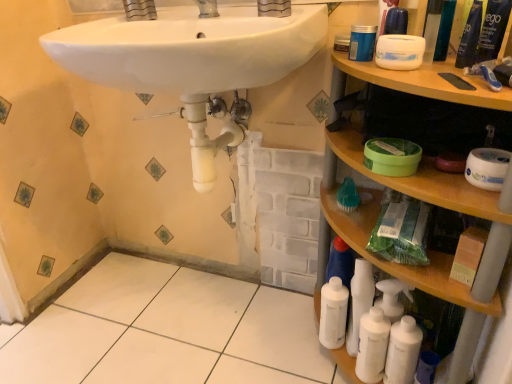
Question: In the image, is blue plastic container at upper right, which appears as the 4th mouthwash when viewed from the top, on the left side or the right side of white matte toothpaste at upper right?

Choices:
 (A) left
 (B) right

Answer: (A)

Question: From a real-world perspective, is blue plastic container at upper right, the 2th mouthwash positioned from the bottom, positioned above or below white matte toothpaste at upper right?

Choices:
 (A) below
 (B) above

Answer: (B)

Question: Which is farther from the white plastic bottles at lower right, acting as the 2th cleaning product starting from the right?

Choices:
 (A) green plastic mouthwash at upper right, arranged as the first mouthwash when viewed from the top
 (B) white glossy mouthwash at lower right, which is counted as the 2th mouthwash, starting from the left
 (C) blue plastic container at upper right, acting as the 1th mouthwash starting from the left
 (D) white matte container at upper right, placed as the 1th toilet paper when sorted from top to bottom
 (E) white plastic bottle at lower right

Answer: (A)

Question: Considering the real-world distances, which object is closest to the white glossy mouthwash at lower right, which is counted as the 2th mouthwash, starting from the left?

Choices:
 (A) white matte toilet paper at right, marked as the 1th toilet paper in a bottom-to-top arrangement
 (B) white plastic bottles at lower right, the first cleaning product viewed from the left
 (C) white plastic bottle at lower right
 (D) blue glossy tube at upper right, the first cleaning product viewed from the right
 (E) wooden cabinet at right

Answer: (B)